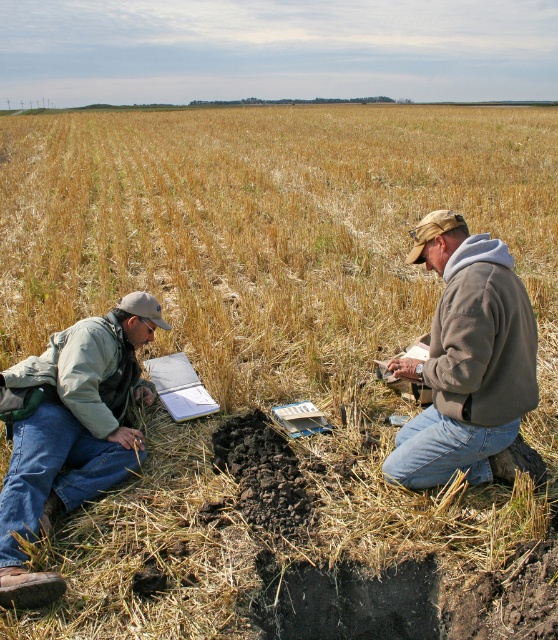
Question: Observing the image, what is the correct spatial positioning of denim jeans at lower left in reference to brown fleece jacket at right?

Choices:
 (A) above
 (B) below

Answer: (B)

Question: Among these objects, which one is farthest from the camera?

Choices:
 (A) brown fleece jacket at right
 (B) denim jeans at lower left

Answer: (A)

Question: Can you confirm if denim jeans at lower left is positioned below brown fleece jacket at right?

Choices:
 (A) yes
 (B) no

Answer: (A)

Question: Observing the image, what is the correct spatial positioning of denim jeans at lower left in reference to brown fleece jacket at right?

Choices:
 (A) left
 (B) right

Answer: (A)